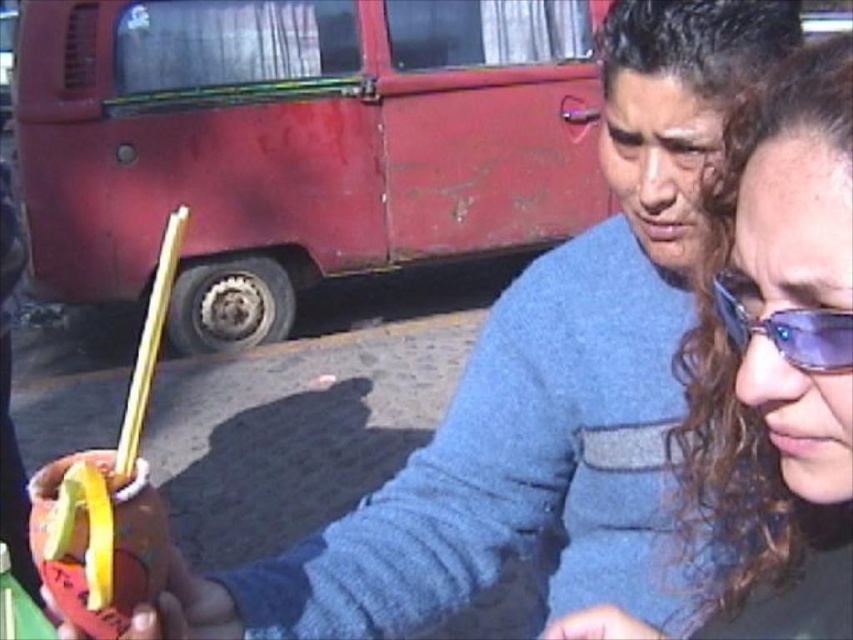
Question: Does matte brown hair at center lie behind shiny blue goggles at right?

Choices:
 (A) no
 (B) yes

Answer: (A)

Question: Considering the relative positions of matte brown hair at center and shiny blue goggles at right in the image provided, where is matte brown hair at center located with respect to shiny blue goggles at right?

Choices:
 (A) right
 (B) left

Answer: (A)

Question: Which of the following is the closest to the observer?

Choices:
 (A) (822, 310)
 (B) (643, 625)

Answer: (A)

Question: Among these points, which one is nearest to the camera?

Choices:
 (A) (828, 316)
 (B) (717, 208)

Answer: (A)

Question: From the image, what is the correct spatial relationship of matte brown hair at center in relation to shiny blue goggles at right?

Choices:
 (A) right
 (B) left

Answer: (A)